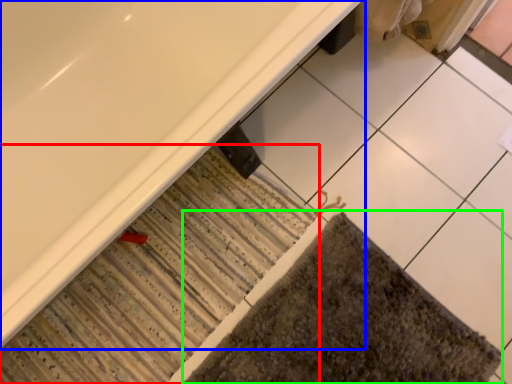
Question: Considering the real-world distances, which object is farthest from bath mat (highlighted by a red box)? bathtub (highlighted by a blue box) or bath mat (highlighted by a green box)?

Choices:
 (A) bathtub
 (B) bath mat

Answer: (A)